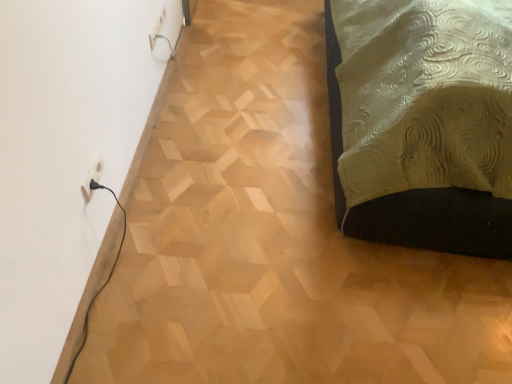
Question: Should I look upward or downward to see white plastic outlet at lower left?

Choices:
 (A) up
 (B) down

Answer: (A)